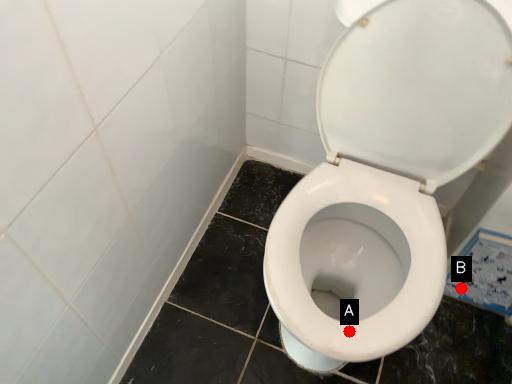
Question: Two points are circled on the image, labeled by A and B beside each circle. Which point is closer to the camera taking this photo?

Choices:
 (A) A is closer
 (B) B is closer

Answer: (A)